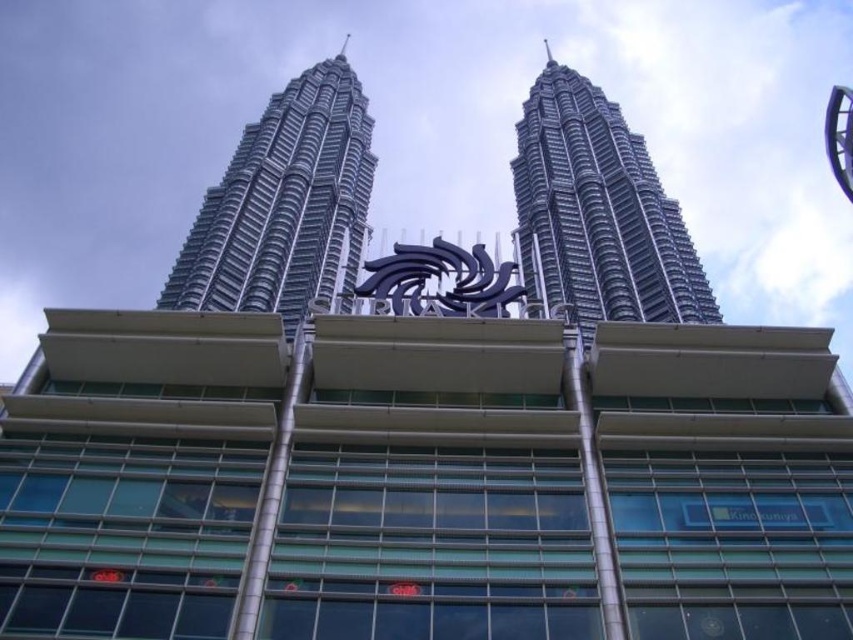
Is point (252, 179) closer to camera compared to point (595, 140)?

Yes, point (252, 179) is in front of point (595, 140).

Is silver metallic skyscraper at upper left taller than silver metallic tower at center?

Correct, silver metallic skyscraper at upper left is much taller as silver metallic tower at center.

Describe the element at coordinates (283, 205) in the screenshot. I see `silver metallic skyscraper at upper left` at that location.

Identify the location of silver metallic skyscraper at upper left. This screenshot has height=640, width=853. (283, 205).